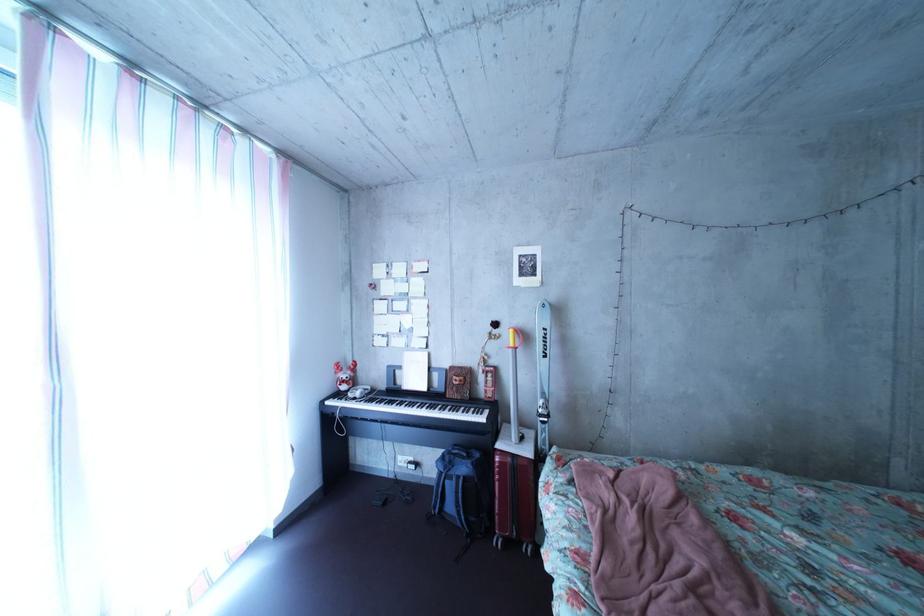
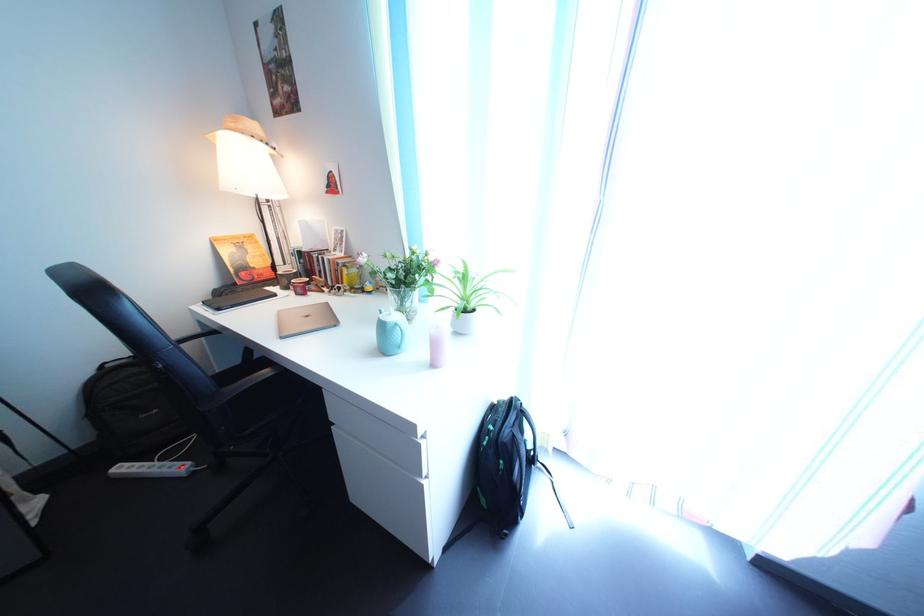
Based on the photo, the first image is from the beginning of the video and the second image is from the end. How did the camera likely rotate when shooting the video?

The camera rotated toward left-down.